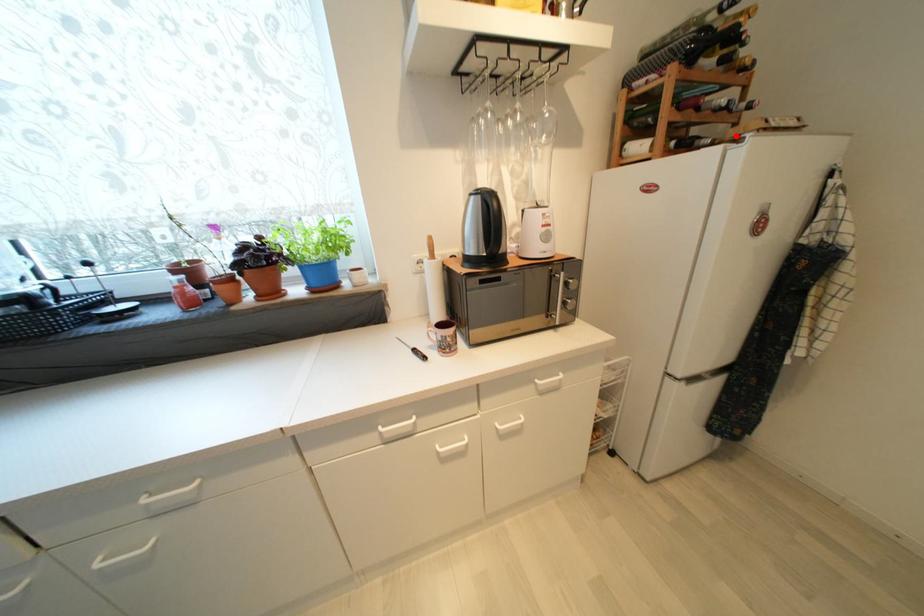
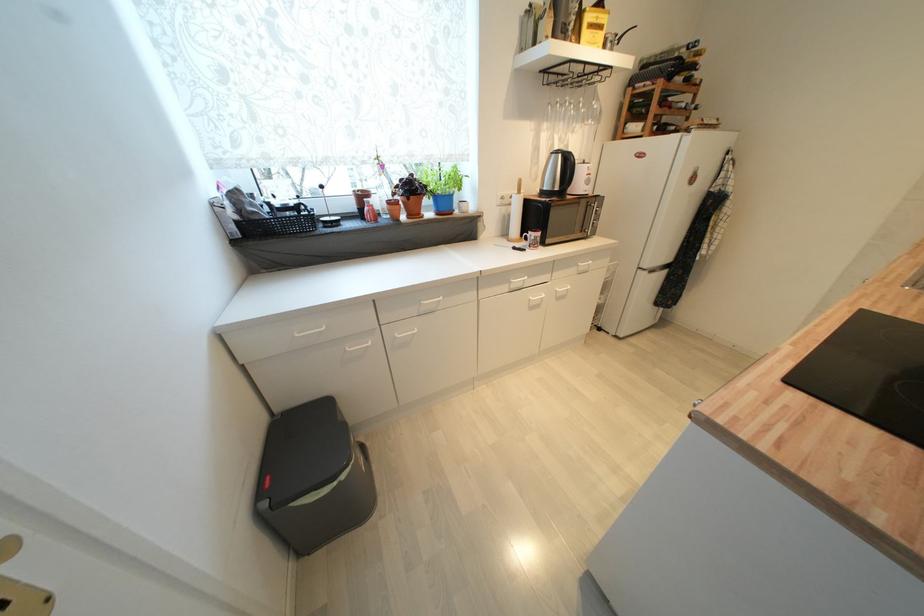
The point at the highlighted location is marked in the first image. Where is the corresponding point in the second image?

(690, 127)